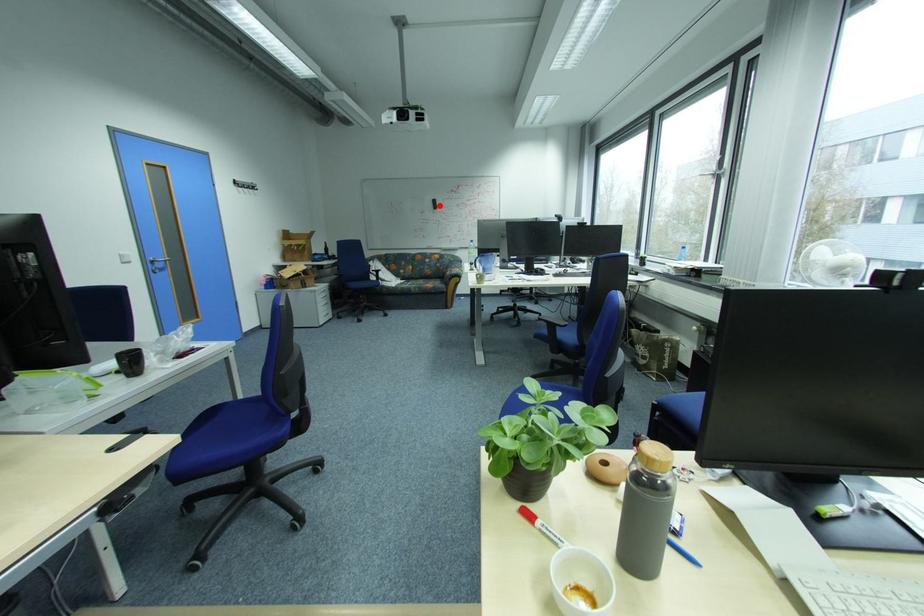
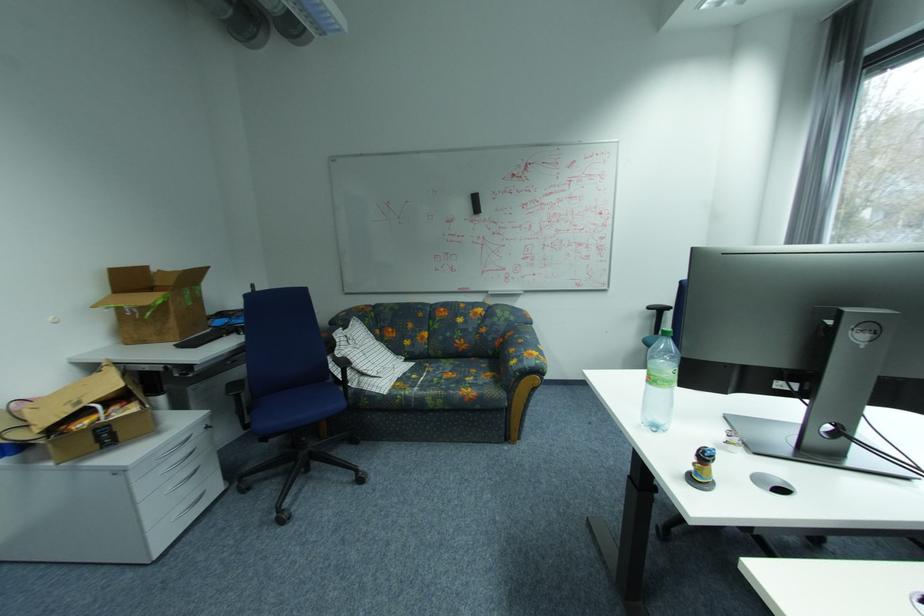
In the second image, find the point that corresponds to the highlighted location in the first image.

(476, 206)